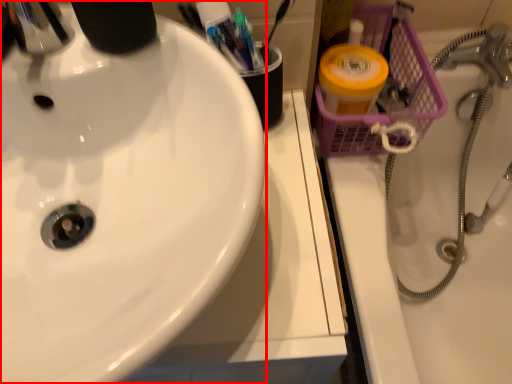
Question: From the image's perspective, what is the correct spatial relationship of sink (annotated by the red box) in relation to bath?

Choices:
 (A) below
 (B) above

Answer: (B)